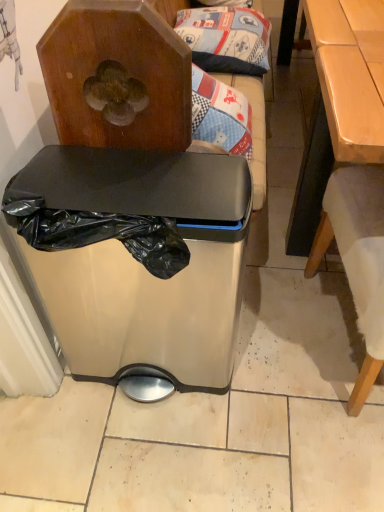
Question: Is satin silver trash can at center completely or partially inside patterned fabric pillow at upper center?

Choices:
 (A) yes
 (B) no

Answer: (B)

Question: From the image's perspective, does patterned fabric pillow at upper center appear higher than satin silver trash can at center?

Choices:
 (A) no
 (B) yes

Answer: (B)

Question: Can you confirm if patterned fabric pillow at upper center is bigger than satin silver trash can at center?

Choices:
 (A) yes
 (B) no

Answer: (B)

Question: Is patterned fabric pillow at upper center wider than satin silver trash can at center?

Choices:
 (A) no
 (B) yes

Answer: (B)

Question: Is patterned fabric pillow at upper center oriented towards satin silver trash can at center?

Choices:
 (A) yes
 (B) no

Answer: (B)

Question: From a real-world perspective, is light brown wooden table at right positioned above or below patterned fabric pillow at upper center?

Choices:
 (A) above
 (B) below

Answer: (B)

Question: Does point (329, 29) appear closer or farther from the camera than point (236, 29)?

Choices:
 (A) closer
 (B) farther

Answer: (A)

Question: Considering the positions of light brown wooden table at right and patterned fabric pillow at upper center in the image, is light brown wooden table at right wider or thinner than patterned fabric pillow at upper center?

Choices:
 (A) wide
 (B) thin

Answer: (A)

Question: From the image's perspective, is light brown wooden table at right located above or below patterned fabric pillow at upper center?

Choices:
 (A) below
 (B) above

Answer: (B)

Question: From a real-world perspective, relative to light brown wooden table at right, is patterned fabric pillow at upper center vertically above or below?

Choices:
 (A) above
 (B) below

Answer: (A)

Question: Would you say patterned fabric pillow at upper center is to the left or to the right of light brown wooden table at right in the picture?

Choices:
 (A) left
 (B) right

Answer: (A)

Question: In the image, is patterned fabric pillow at upper center positioned in front of or behind light brown wooden table at right?

Choices:
 (A) front
 (B) behind

Answer: (B)

Question: From the image's perspective, relative to light brown wooden table at right, is patterned fabric pillow at upper center above or below?

Choices:
 (A) below
 (B) above

Answer: (A)

Question: Is patterned fabric pillow at upper center to the left or to the right of satin silver trash can at center in the image?

Choices:
 (A) right
 (B) left

Answer: (A)

Question: In terms of height, does patterned fabric pillow at upper center look taller or shorter compared to satin silver trash can at center?

Choices:
 (A) short
 (B) tall

Answer: (A)